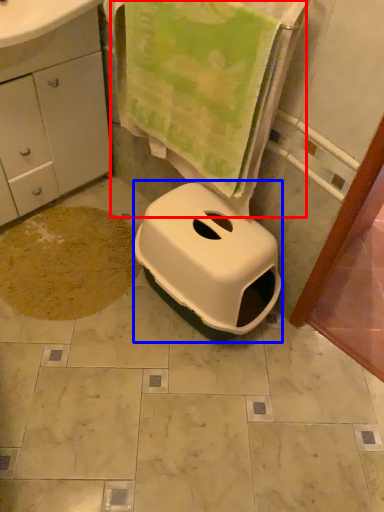
Question: Which object appears closest to the camera in this image, beach towel (highlighted by a red box) or bidet (highlighted by a blue box)?

Choices:
 (A) beach towel
 (B) bidet

Answer: (A)